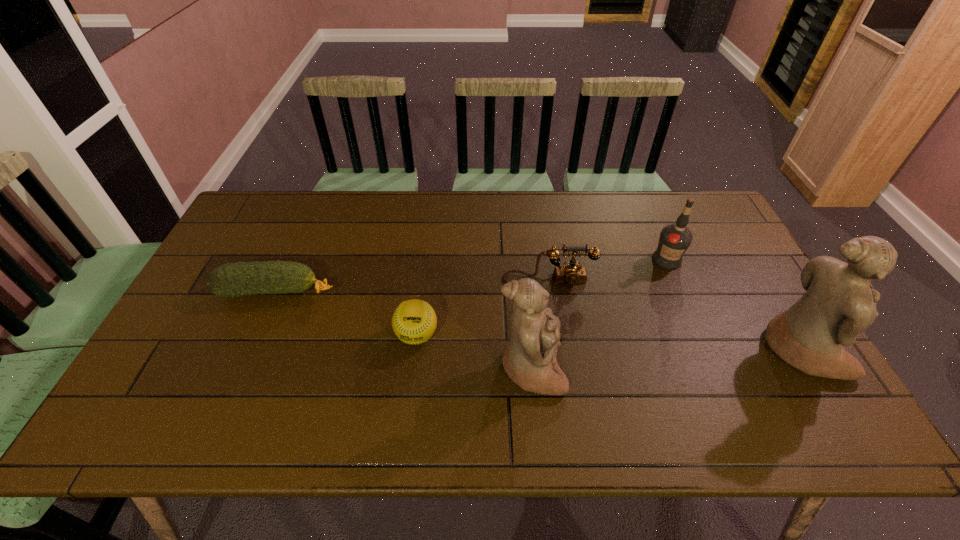
Where is `the shorter figurine`? The height and width of the screenshot is (540, 960). the shorter figurine is located at coordinates (530, 359).

Where is `the second tallest object`? The height and width of the screenshot is (540, 960). the second tallest object is located at coordinates (530, 359).

The image size is (960, 540). Identify the location of the right figurine. (839, 303).

Image resolution: width=960 pixels, height=540 pixels. Identify the location of the tallest object. [x=839, y=303].

Where is `vodka`? vodka is located at coordinates (674, 240).

The height and width of the screenshot is (540, 960). Identify the location of the fourth shortest object. (674, 240).

Where is `the leftmost object`? This screenshot has width=960, height=540. the leftmost object is located at coordinates (238, 279).

This screenshot has height=540, width=960. Find the location of `the shortest object`. the shortest object is located at coordinates [238, 279].

Find the location of a particular element. softball is located at coordinates (414, 321).

Find the location of a particular element. Image resolution: width=960 pixels, height=540 pixels. telephone is located at coordinates (572, 273).